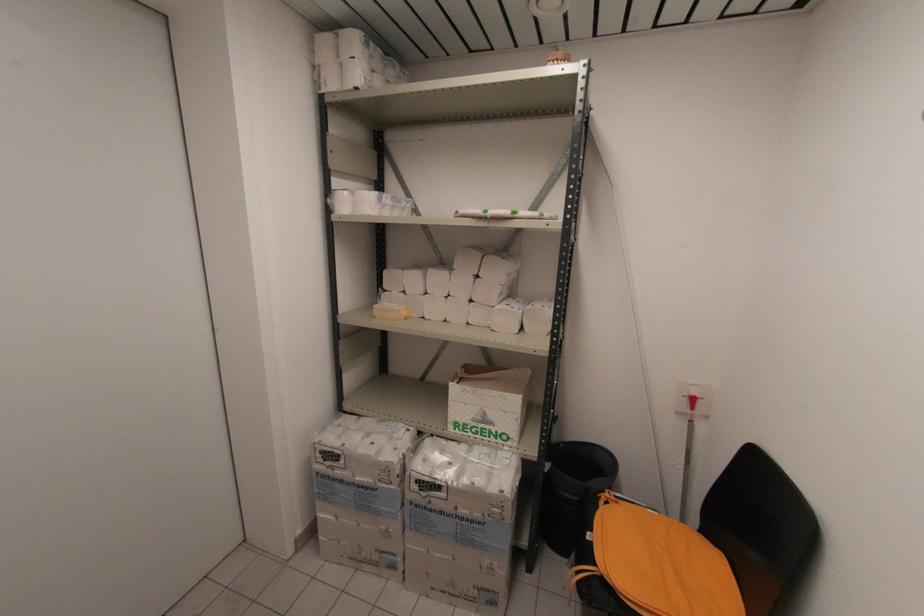
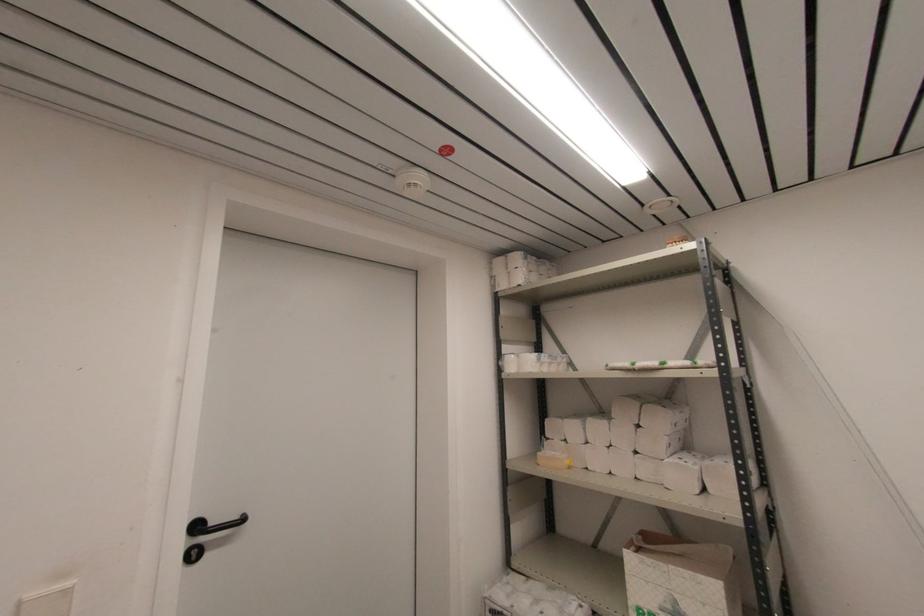
The point at (362,83) is marked in the first image. Where is the corresponding point in the second image?

(524, 282)